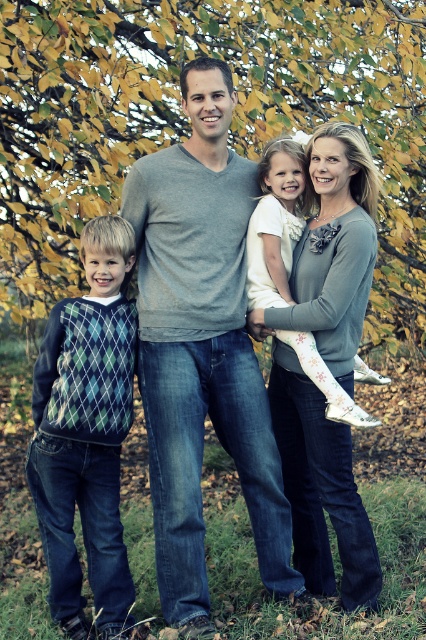
Does gray matte sweater at center lie behind white textured sweater at center?

No, gray matte sweater at center is in front of white textured sweater at center.

Between gray matte sweater at center and white textured sweater at center, which one has less height?

Standing shorter between the two is white textured sweater at center.

Image resolution: width=426 pixels, height=640 pixels. I want to click on gray matte sweater at center, so click(201, 348).

Which is below, white textured sweater at center or green argyle sweater at left?

Positioned lower is green argyle sweater at left.

Is point (284, 316) less distant than point (48, 364)?

No, (284, 316) is further to viewer.

Find the location of `white textured sweater at center`. white textured sweater at center is located at coordinates (x=333, y=250).

Who is lower down, gray matte sweater at center or green argyle sweater at left?

green argyle sweater at left

Identify the location of gray matte sweater at center. (201, 348).

At what (x,y) coordinates should I click in order to perform the action: click on gray matte sweater at center. Please return your answer as a coordinate pair (x, y). The width and height of the screenshot is (426, 640). Looking at the image, I should click on (201, 348).